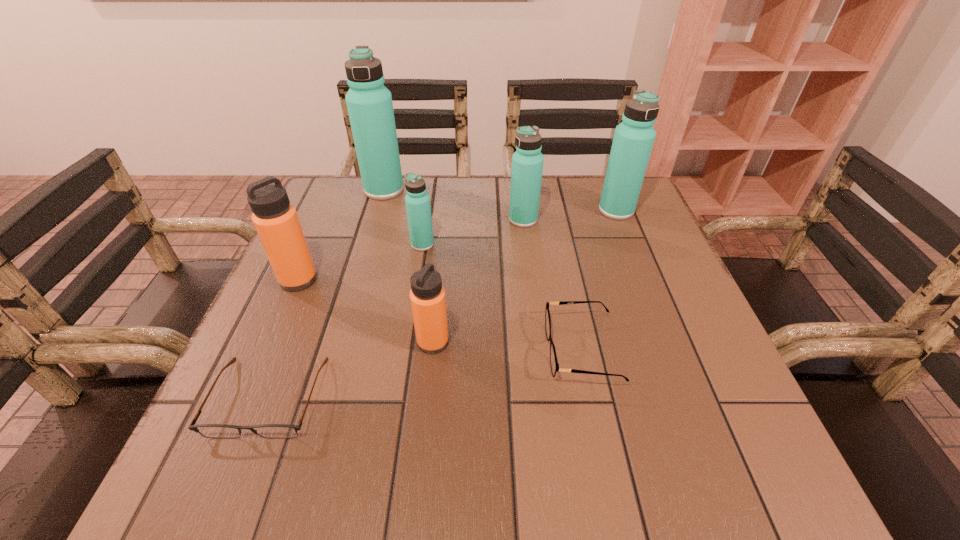
Locate an element on the screen. Image resolution: width=960 pixels, height=540 pixels. object that is at the near left corner is located at coordinates (222, 431).

The height and width of the screenshot is (540, 960). I want to click on object at the far right corner, so click(x=633, y=140).

Find the location of a particular element. The height and width of the screenshot is (540, 960). vacant space at the far edge is located at coordinates (503, 210).

Find the location of `vacant space at the near edge`. vacant space at the near edge is located at coordinates (566, 489).

The image size is (960, 540). I want to click on blank space at the left edge, so click(x=362, y=254).

Where is `vacant space at the right edge of the desktop`? The image size is (960, 540). vacant space at the right edge of the desktop is located at coordinates (634, 241).

Find the location of `vacant space at the far left corner`. vacant space at the far left corner is located at coordinates (340, 188).

The width and height of the screenshot is (960, 540). In order to click on vacant space that's between the fifth farthest thermos bottle and the nearest aqua thermos bottle in this screenshot , I will do `click(360, 262)`.

Identify the location of empty location between the shorter spectacles and the farthest aqua thermos bottle. This screenshot has width=960, height=540. (326, 293).

Image resolution: width=960 pixels, height=540 pixels. I want to click on vacant area between the smaller orange thermos bottle and the third biggest aqua thermos bottle, so click(478, 281).